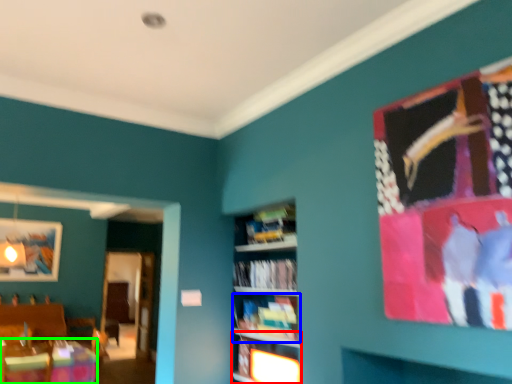
Question: Which is nearer to the shelf (highlighted by a red box)? book (highlighted by a blue box) or table (highlighted by a green box).

Choices:
 (A) book
 (B) table

Answer: (A)